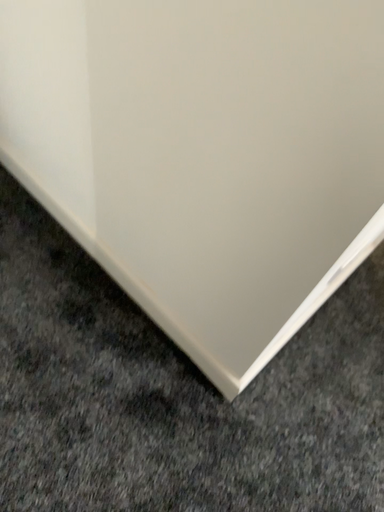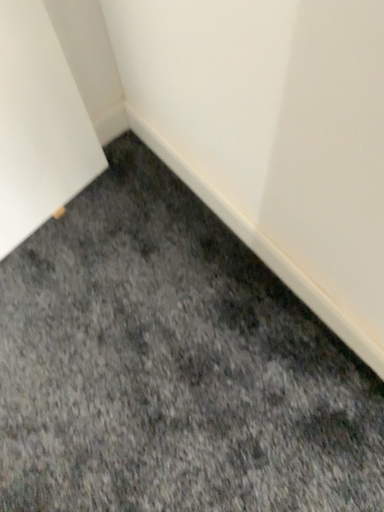
Question: Which way did the camera rotate in the video?

Choices:
 (A) rotated right
 (B) rotated left

Answer: (B)